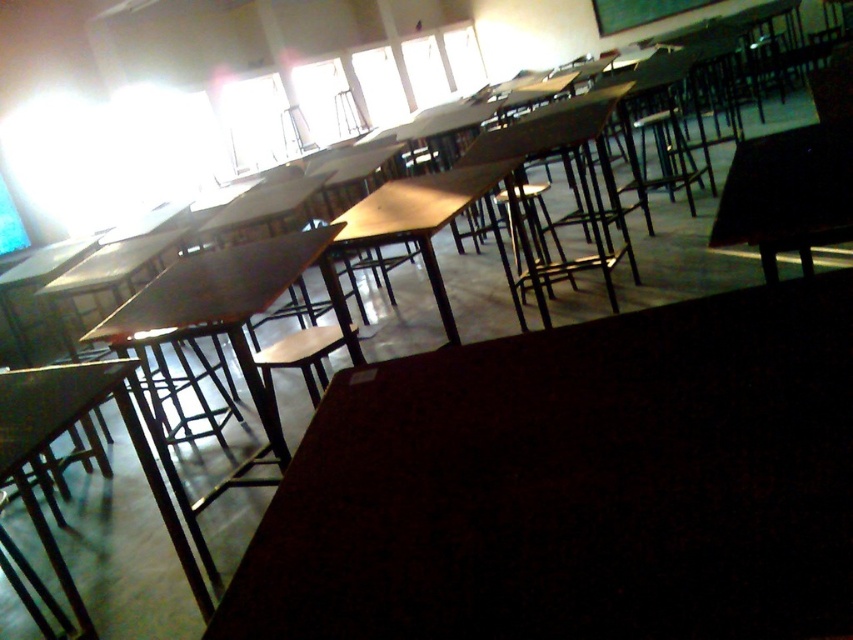
Question: Which object appears closest to the camera in this image?

Choices:
 (A) black glossy table at right
 (B) matte black table at lower left

Answer: (A)

Question: Where is black glossy table at right located in relation to wooden table at center in the image?

Choices:
 (A) below
 (B) above

Answer: (A)

Question: Observing the image, what is the correct spatial positioning of black glossy table at right in reference to wooden table at center?

Choices:
 (A) below
 (B) above

Answer: (A)

Question: Is matte black table at lower left to the right of wooden table at center from the viewer's perspective?

Choices:
 (A) no
 (B) yes

Answer: (A)

Question: Which of these objects is positioned farthest from the wooden table at center?

Choices:
 (A) matte black table at lower left
 (B) black glossy table at right

Answer: (A)

Question: Which of the following is the farthest from the observer?

Choices:
 (A) click(59, 394)
 (B) click(450, 200)

Answer: (B)